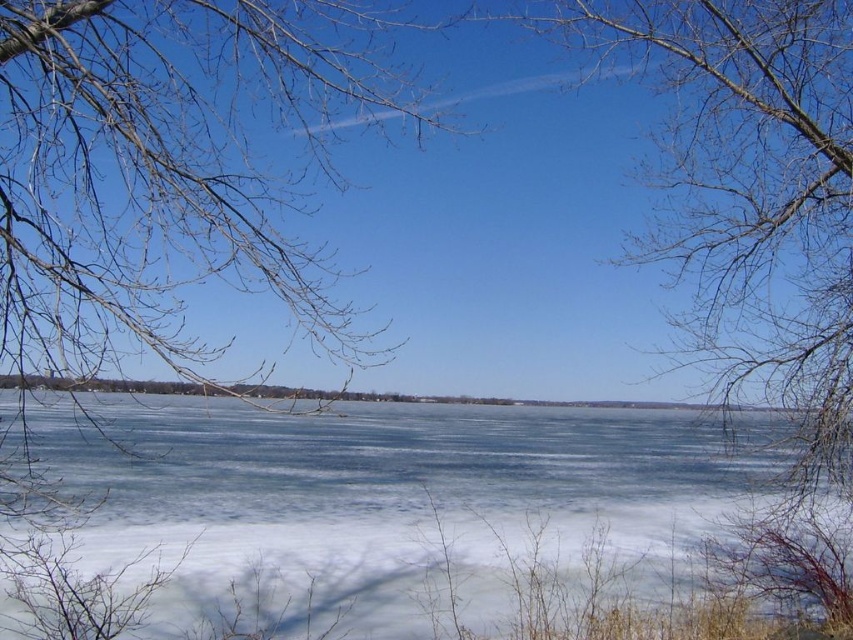
Measure the distance between white ice at center and camera.

white ice at center and camera are 20.97 feet apart from each other.

Which is in front, point (137, 508) or point (790, 148)?

Point (790, 148) is in front.

Which is in front, point (146, 481) or point (790, 163)?

Positioned in front is point (790, 163).

Find the location of a particular element. This screenshot has height=640, width=853. white ice at center is located at coordinates [402, 496].